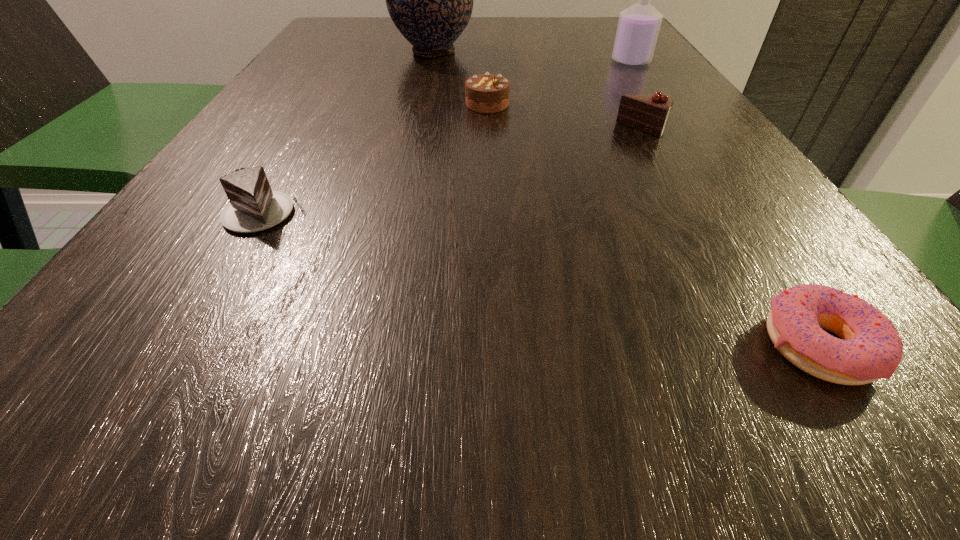
Locate an element on the screen. chocolate cake at the right edge is located at coordinates (648, 113).

Find the location of a particular element. The width and height of the screenshot is (960, 540). doughnut present at the right edge is located at coordinates (870, 348).

This screenshot has height=540, width=960. In order to click on object positioned at the near right corner in this screenshot , I will do `click(870, 348)`.

Image resolution: width=960 pixels, height=540 pixels. In the image, there is a desktop. In order to click on vacant area at the far edge in this screenshot , I will do `click(392, 40)`.

Where is `vacant space at the near edge of the desktop`? vacant space at the near edge of the desktop is located at coordinates (759, 471).

Where is `free space at the left edge of the desktop`? This screenshot has height=540, width=960. free space at the left edge of the desktop is located at coordinates (277, 153).

Locate an element on the screen. The width and height of the screenshot is (960, 540). vacant space at the right edge of the desktop is located at coordinates (706, 264).

Identify the location of blank space at the far left corner of the desktop. The height and width of the screenshot is (540, 960). (378, 23).

Identify the location of vacant area at the near right corner. This screenshot has height=540, width=960. (825, 490).

Locate an element on the screen. The height and width of the screenshot is (540, 960). free space between the tallest object and the nearest chocolate cake is located at coordinates (349, 132).